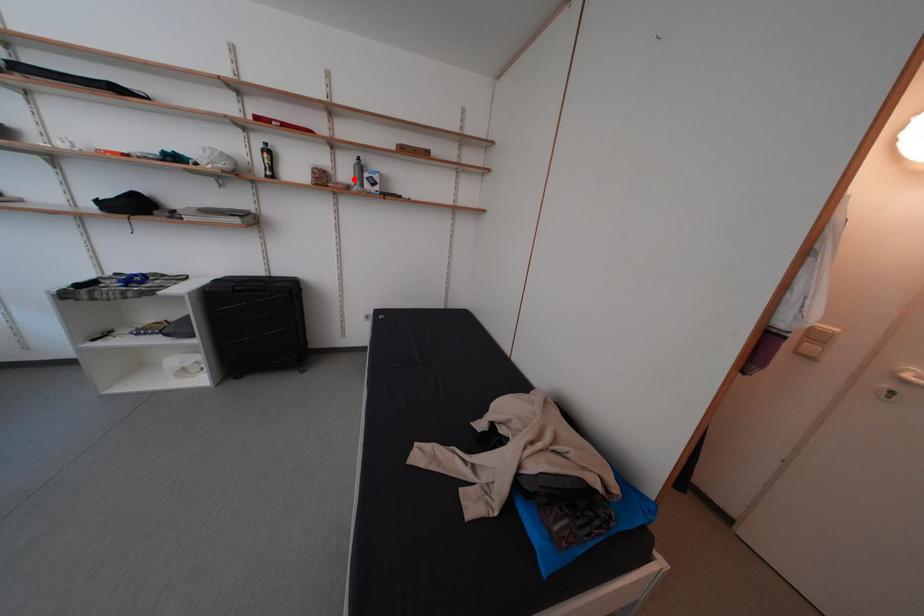
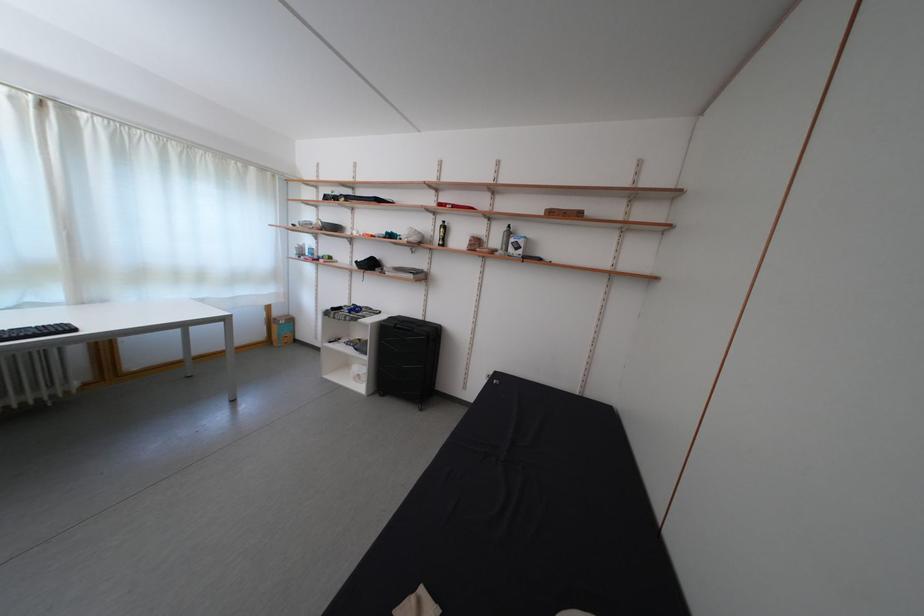
Locate, in the second image, the point that corresponds to the highlighted location in the first image.

(505, 246)